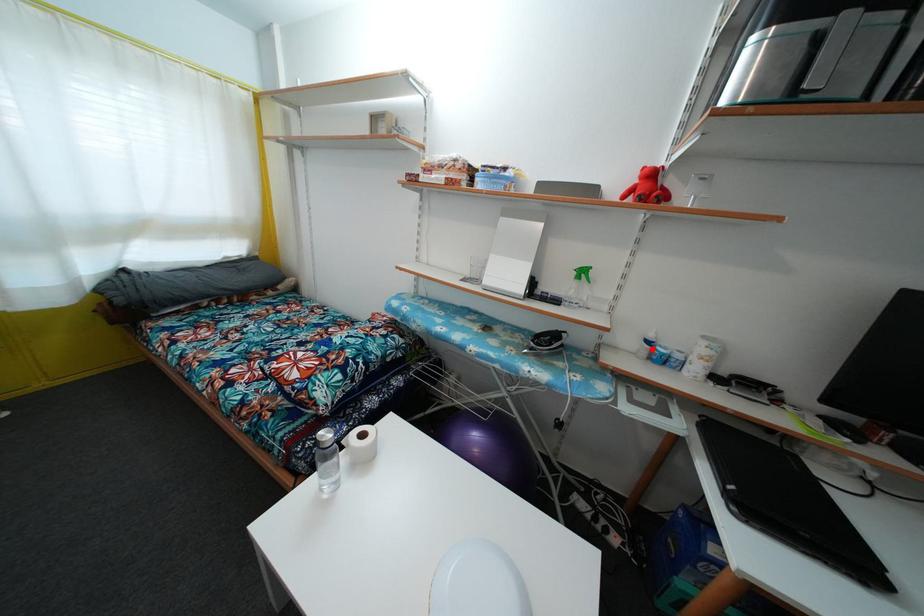
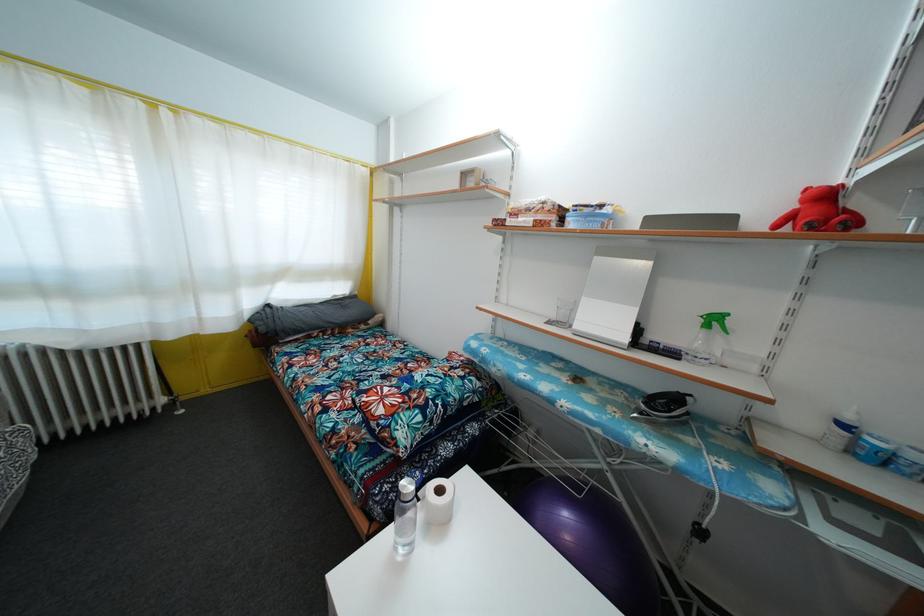
In the second image, find the point that corresponds to the highlighted location in the first image.

(848, 432)